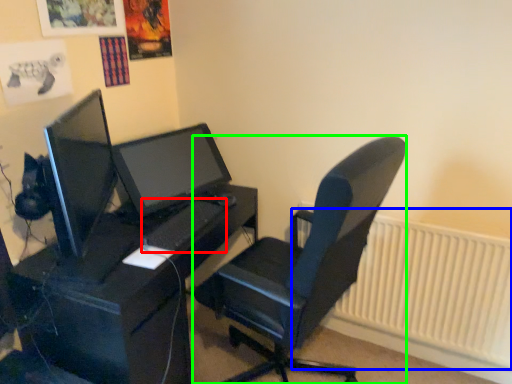
Question: Which object is the farthest from keyboard (highlighted by a red box)? Choose among these: radiator (highlighted by a blue box) or chair (highlighted by a green box).

Choices:
 (A) radiator
 (B) chair

Answer: (A)